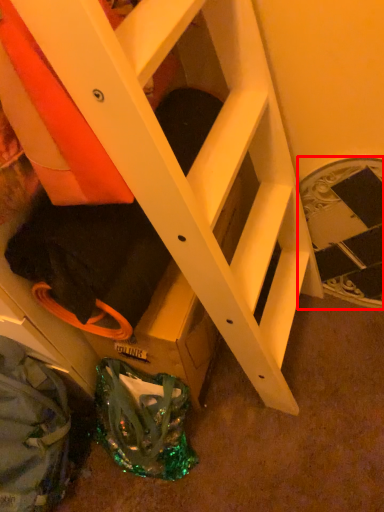
Question: Considering the relative positions of stairwell (annotated by the red box) and bag in the image provided, where is stairwell (annotated by the red box) located with respect to the staircase?

Choices:
 (A) right
 (B) left

Answer: (A)